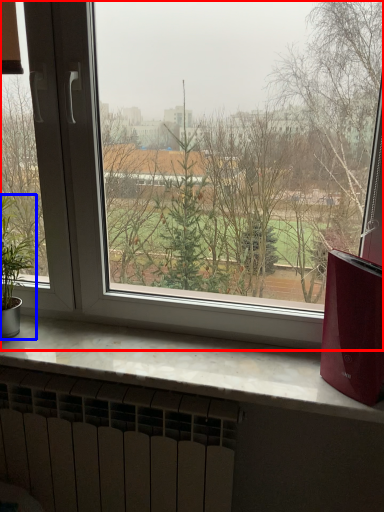
Question: Among these objects, which one is farthest to the camera, window (highlighted by a red box) or houseplant (highlighted by a blue box)?

Choices:
 (A) window
 (B) houseplant

Answer: (B)